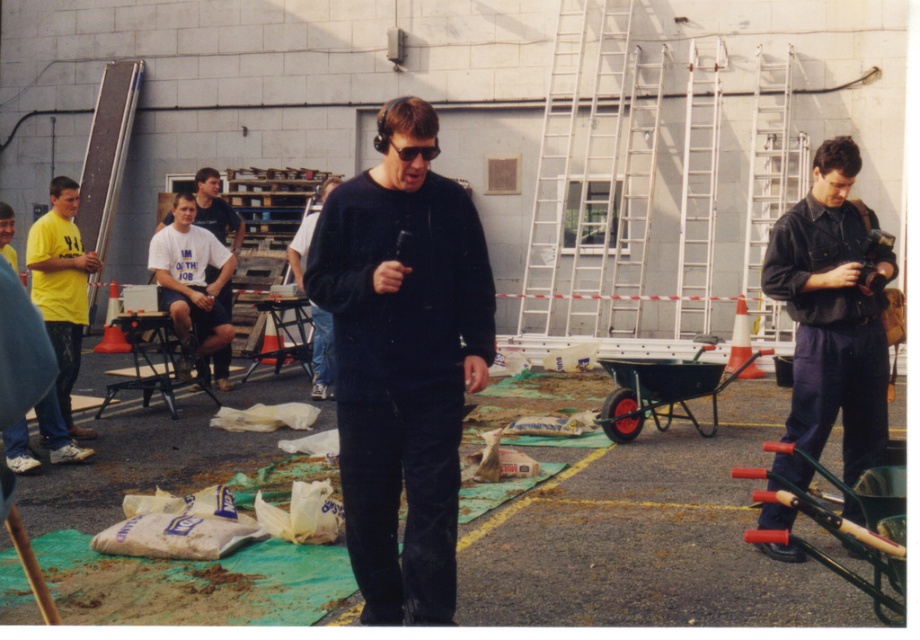
Who is lower down, dark blue corduroy sweater at center or dark blue denim jumpsuit at right?

dark blue corduroy sweater at center is lower down.

Is point (427, 218) behind point (880, 417)?

That is False.

At what (x,y) coordinates should I click in order to perform the action: click on dark blue corduroy sweater at center. Please return your answer as a coordinate pair (x, y). Image resolution: width=920 pixels, height=640 pixels. Looking at the image, I should click on (401, 362).

Is point (355, 364) positioned before point (334, 186)?

Yes.

Which is more to the left, dark blue corduroy sweater at center or black matte shirt at center?

Positioned to the left is black matte shirt at center.

The image size is (920, 640). Describe the element at coordinates (401, 362) in the screenshot. I see `dark blue corduroy sweater at center` at that location.

Where is `dark blue corduroy sweater at center`? The height and width of the screenshot is (640, 920). dark blue corduroy sweater at center is located at coordinates (401, 362).

Who is positioned more to the right, yellow matte shirt at left or black plastic sunglasses at center?

black plastic sunglasses at center

Which is in front, point (64, 216) or point (394, 147)?

Point (394, 147)

The image size is (920, 640). Identify the location of yellow matte shirt at left. (61, 288).

Locate an element on the screen. yellow matte shirt at left is located at coordinates (61, 288).